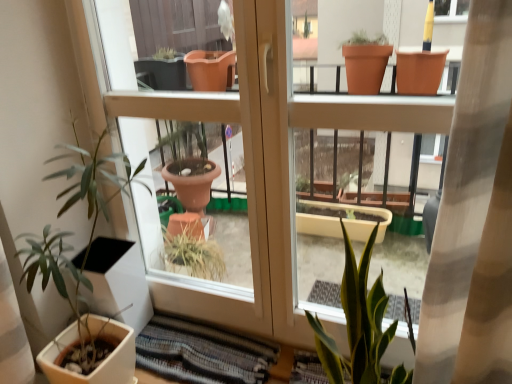
Question: In terms of width, does matte brown screen door at lower left look wider or thinner when compared to green matte plant at left?

Choices:
 (A) thin
 (B) wide

Answer: (A)

Question: From the image's perspective, relative to green matte plant at left, is matte brown screen door at lower left above or below?

Choices:
 (A) above
 (B) below

Answer: (A)

Question: Which object is positioned farthest from the green matte plant at left?

Choices:
 (A) striped fabric rug at lower center
 (B) matte brown screen door at lower left

Answer: (A)

Question: Which of these objects is positioned closest to the matte brown screen door at lower left?

Choices:
 (A) striped fabric rug at lower center
 (B) green matte plant at left

Answer: (A)